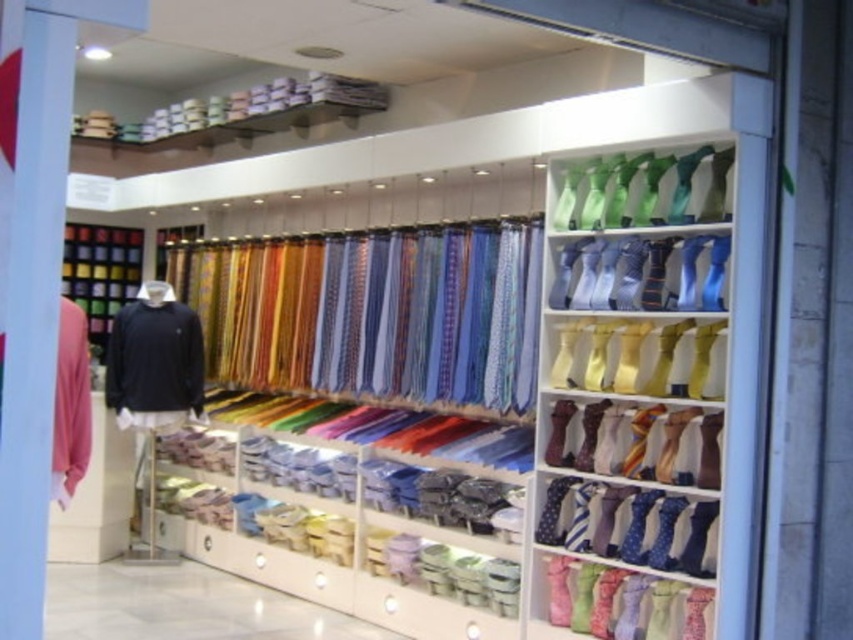
Question: Which of the following is the farthest from the observer?

Choices:
 (A) (219, 342)
 (B) (157, 397)
 (C) (70, 332)
 (D) (724, 221)

Answer: (A)

Question: Can you confirm if black matte sweater at left is wider than matte pink sweater at left?

Choices:
 (A) no
 (B) yes

Answer: (B)

Question: Which object appears farthest from the camera in this image?

Choices:
 (A) matte pink sweater at left
 (B) shiny silk ties at center
 (C) black matte sweater at left

Answer: (C)

Question: Does black matte sweater at left appear on the left side of matte pink sweater at left?

Choices:
 (A) yes
 (B) no

Answer: (A)

Question: Which point is closer to the camera?

Choices:
 (A) pyautogui.click(x=78, y=432)
 (B) pyautogui.click(x=468, y=232)

Answer: (A)

Question: Does shiny silk ties at center appear on the left side of matte pink sweater at left?

Choices:
 (A) yes
 (B) no

Answer: (B)